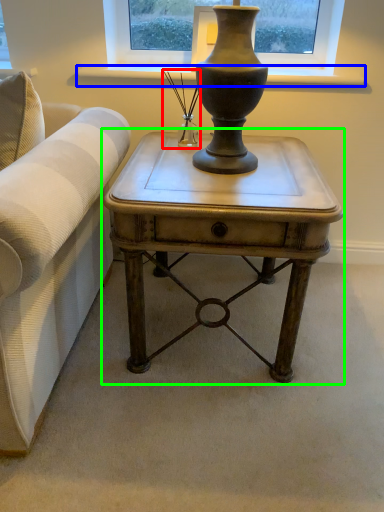
Question: Which object is the farthest from candle holder (highlighted by a red box)? Choose among these: window sill (highlighted by a blue box) or table (highlighted by a green box).

Choices:
 (A) window sill
 (B) table

Answer: (B)